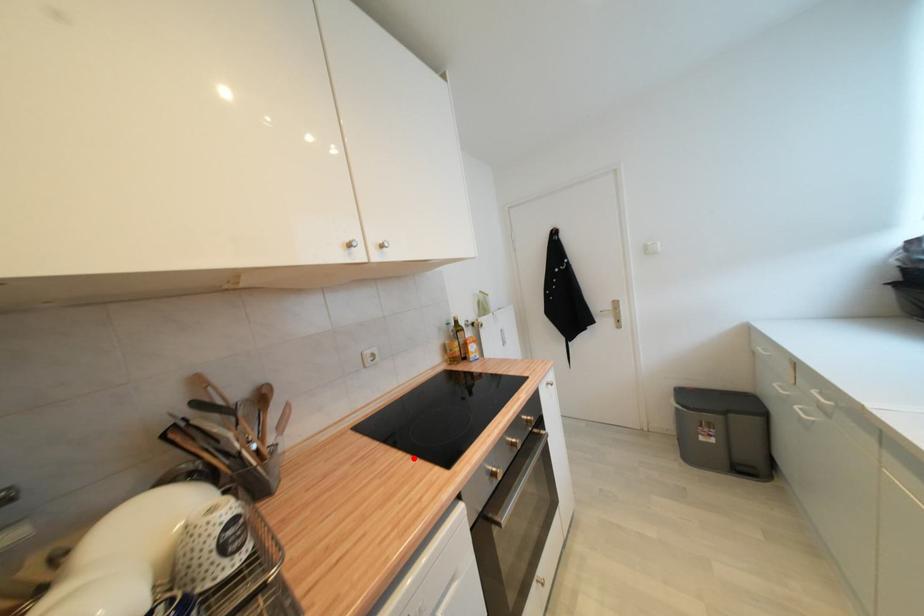
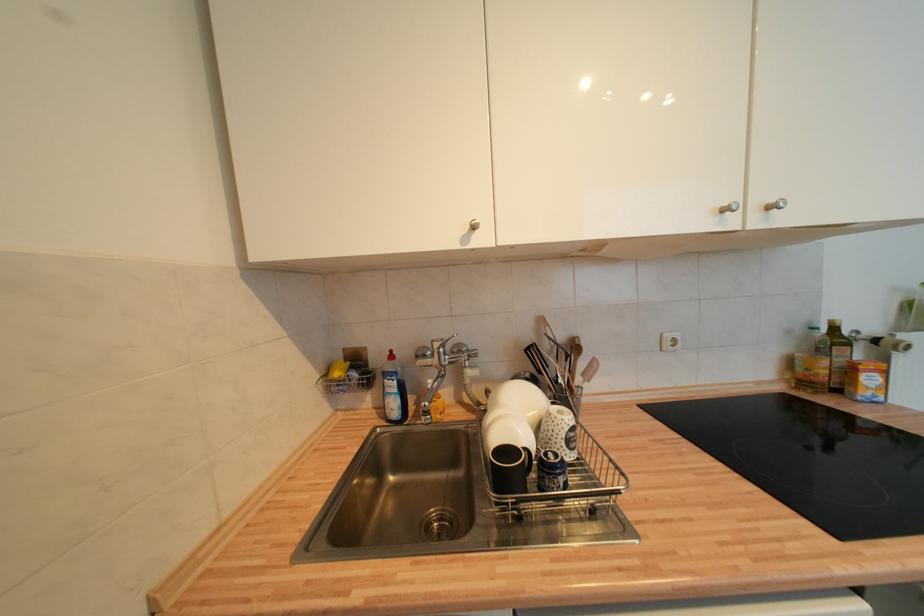
Question: I am providing you with two images of the same scene from different viewpoints. A red point is marked on the first image. At the location where the point appears in image 1, is it still visible in image 2?

Choices:
 (A) Yes
 (B) No

Answer: (A)